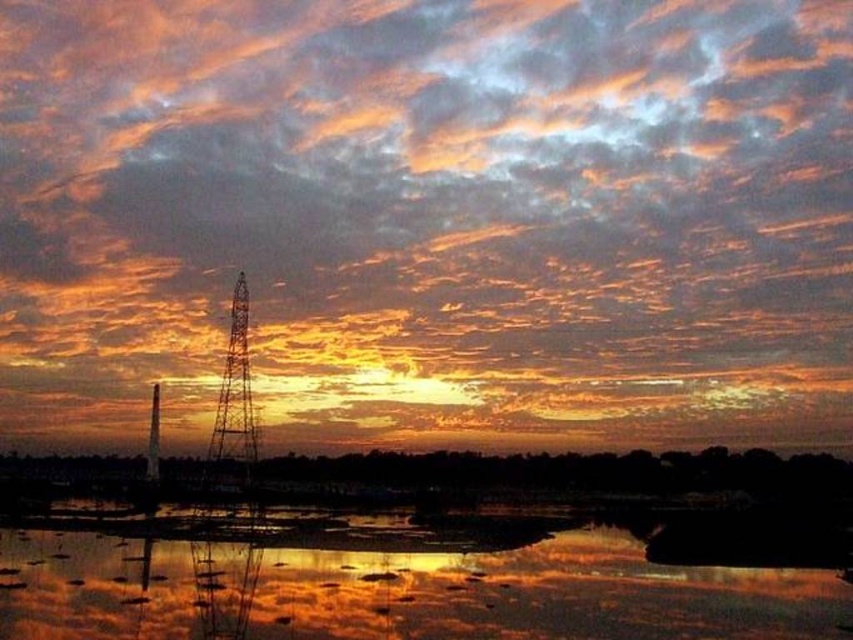
Which is more to the right, reflective water at center or metallic wire tower at center?

reflective water at center is more to the right.

Does reflective water at center appear over metallic wire tower at center?

Actually, reflective water at center is below metallic wire tower at center.

This screenshot has width=853, height=640. In order to click on reflective water at center in this screenshot , I will do `click(399, 588)`.

Where is `reflective water at center`? reflective water at center is located at coordinates (399, 588).

Does orange matte cloud at upper center come behind reflective water at center?

Result: That is True.

In the scene shown: Does orange matte cloud at upper center appear under reflective water at center?

No, orange matte cloud at upper center is not below reflective water at center.

Image resolution: width=853 pixels, height=640 pixels. Identify the location of orange matte cloud at upper center. (430, 216).

In the scene shown: Between orange matte cloud at upper center and metallic wire tower at center, which one appears on the left side from the viewer's perspective?

Positioned to the left is metallic wire tower at center.

Based on the photo, does orange matte cloud at upper center have a larger size compared to metallic wire tower at center?

Correct, orange matte cloud at upper center is larger in size than metallic wire tower at center.

Which is in front, point (561, 291) or point (242, 353)?

Point (561, 291) is more forward.

This screenshot has height=640, width=853. I want to click on orange matte cloud at upper center, so click(x=430, y=216).